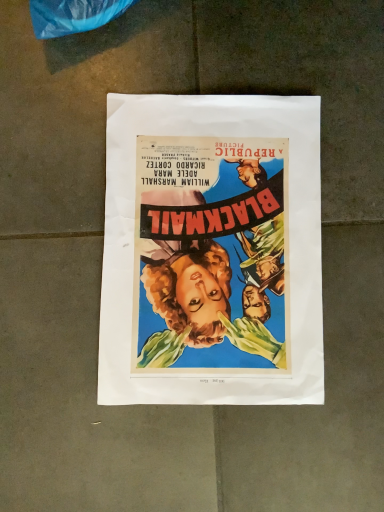
What is the approximate height of vibrant paper poster at center?

0.43 inches.

Where is `vibrant paper poster at center`? The image size is (384, 512). vibrant paper poster at center is located at coordinates 212,251.

Image resolution: width=384 pixels, height=512 pixels. Describe the element at coordinates (212, 251) in the screenshot. I see `vibrant paper poster at center` at that location.

Find the location of a particular element. The width and height of the screenshot is (384, 512). vibrant paper poster at center is located at coordinates (212, 251).